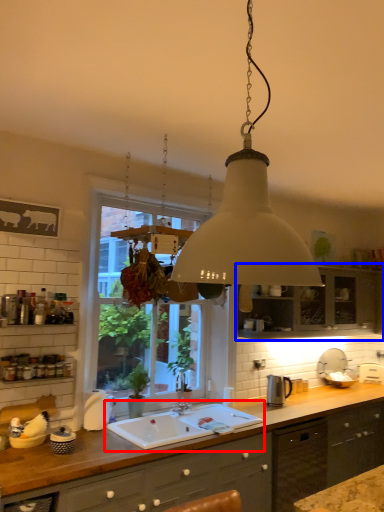
Question: Which point is further to the camera, sink (highlighted by a red box) or cabinetry (highlighted by a blue box)?

Choices:
 (A) sink
 (B) cabinetry

Answer: (B)